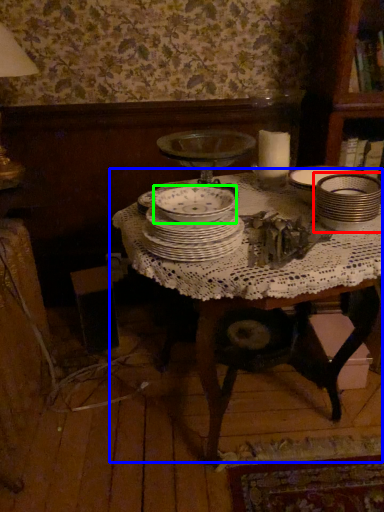
Question: Which object is positioned closest to tableware (highlighted by a red box)? Select from table (highlighted by a blue box) and bowl (highlighted by a green box).

Choices:
 (A) table
 (B) bowl

Answer: (A)